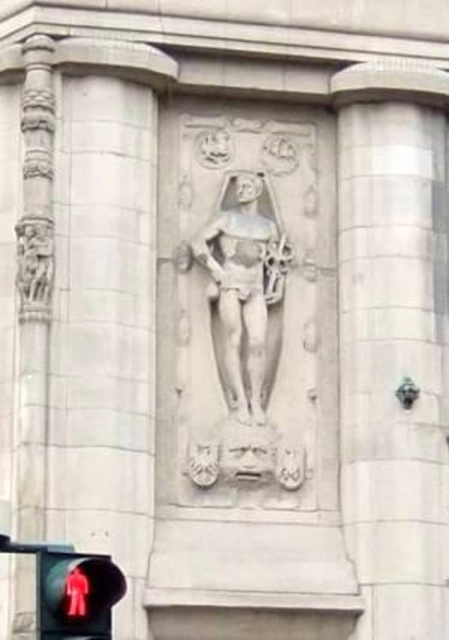
Does white stone pillar at center have a greater width compared to red glass pedestrian at lower left?

Correct, the width of white stone pillar at center exceeds that of red glass pedestrian at lower left.

Is point (365, 483) farther from viewer compared to point (75, 592)?

Yes, point (365, 483) is farther from viewer.

Is point (430, 333) positioned before point (117, 577)?

No, (430, 333) is behind (117, 577).

Where is `white stone pillar at center`? The height and width of the screenshot is (640, 449). white stone pillar at center is located at coordinates (392, 340).

Who is shorter, white stone pillar at center or white stone figure at center?

white stone figure at center is shorter.

Between white stone pillar at center and white stone figure at center, which one is positioned lower?

white stone pillar at center is lower down.

Does point (357, 156) come closer to viewer compared to point (219, 324)?

No, (357, 156) is behind (219, 324).

In order to click on white stone pillar at center in this screenshot , I will do `click(392, 340)`.

Is white stone figure at center closer to the viewer compared to red glass pedestrian at lower left?

No.

Between white stone figure at center and red glass pedestrian at lower left, which one appears on the right side from the viewer's perspective?

Positioned to the right is white stone figure at center.

Is point (220, 305) positioned behind point (57, 554)?

Yes.

Identify the location of white stone figure at center. This screenshot has height=640, width=449. (243, 291).